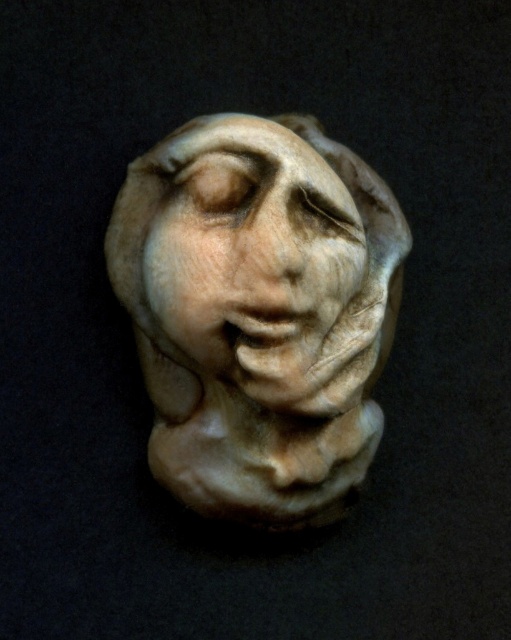
Question: Which of the following is the closest to the observer?

Choices:
 (A) (316, 208)
 (B) (262, 396)

Answer: (B)

Question: In this image, where is white marble sculpture at center located relative to white marble face at center?

Choices:
 (A) left
 (B) right

Answer: (B)

Question: Does white marble sculpture at center have a larger size compared to white marble face at center?

Choices:
 (A) yes
 (B) no

Answer: (A)

Question: Can you confirm if white marble sculpture at center is positioned to the left of white marble face at center?

Choices:
 (A) yes
 (B) no

Answer: (B)

Question: Which object appears closest to the camera in this image?

Choices:
 (A) white marble face at center
 (B) white marble sculpture at center

Answer: (A)